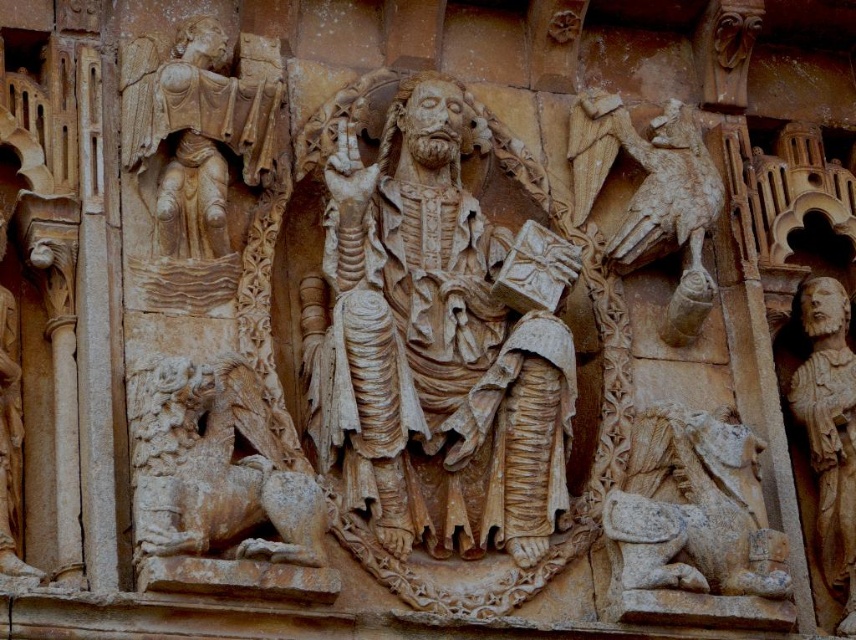
Question: Which of the following is the closest to the observer?

Choices:
 (A) click(x=646, y=550)
 (B) click(x=189, y=36)
 (C) click(x=667, y=212)

Answer: (A)

Question: In this image, where is carved stone lion at lower left located relative to carved stone eagle at right?

Choices:
 (A) above
 (B) below

Answer: (B)

Question: Which is nearer to the beige stone angel at upper left?

Choices:
 (A) carved stone lion at lower left
 (B) beige stone lion at lower right
 (C) carved stone figure at center
 (D) beige stone figure at right

Answer: (C)

Question: Can you confirm if beige stone angel at upper left is positioned above carved stone eagle at right?

Choices:
 (A) no
 (B) yes

Answer: (B)

Question: Is carved stone figure at center below carved stone lion at lower left?

Choices:
 (A) yes
 (B) no

Answer: (B)

Question: Among these objects, which one is farthest from the camera?

Choices:
 (A) carved stone eagle at right
 (B) carved stone figure at center

Answer: (A)